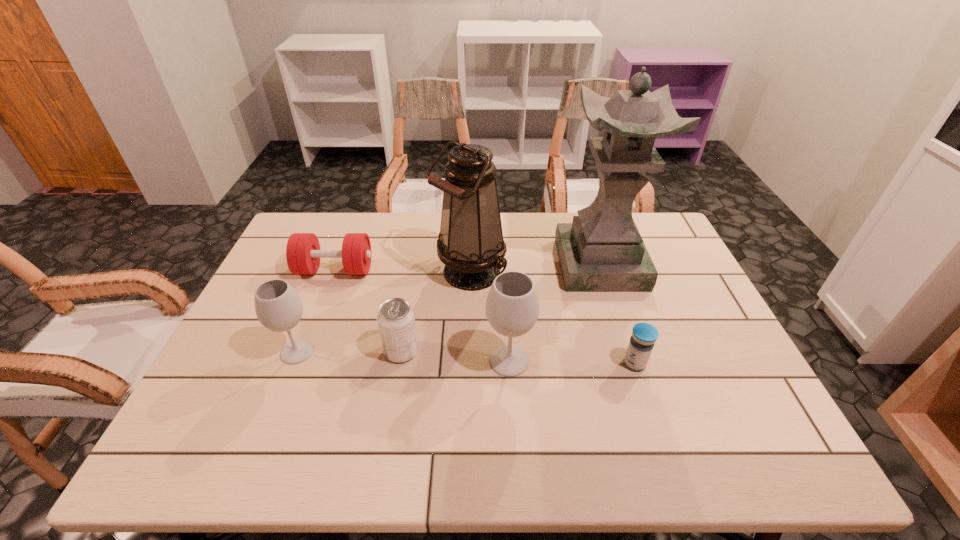
You are a GUI agent. You are given a task and a screenshot of the screen. Output one action in this format:
    pyautogui.click(x=<x>, y=<y>)
    Task: Click on the dumbbell that is at the left edge
    
    Given the screenshot: What is the action you would take?
    pyautogui.click(x=303, y=254)

At what (x,y) coordinates should I click in order to perform the action: click on object positioned at the right edge. Please return your answer as a coordinate pair (x, y). The width and height of the screenshot is (960, 540). Looking at the image, I should click on (602, 250).

Where is `object that is at the far right corner`? object that is at the far right corner is located at coordinates (602, 250).

Where is `vacant space at the far edge of the desktop`? The width and height of the screenshot is (960, 540). vacant space at the far edge of the desktop is located at coordinates (536, 220).

The image size is (960, 540). I want to click on vacant space at the near edge of the desktop, so click(x=288, y=400).

I want to click on blank space at the left edge of the desktop, so click(276, 357).

The width and height of the screenshot is (960, 540). Identify the location of vacant space at the right edge of the desktop. (686, 359).

Where is `free space at the far right corner`? free space at the far right corner is located at coordinates (659, 244).

Identify the location of vacant space that is in between the medicine and the right wineglass. The height and width of the screenshot is (540, 960). (572, 362).

What are the coordinates of `vacant region between the dumbbell and the right wineglass` in the screenshot? It's located at (422, 315).